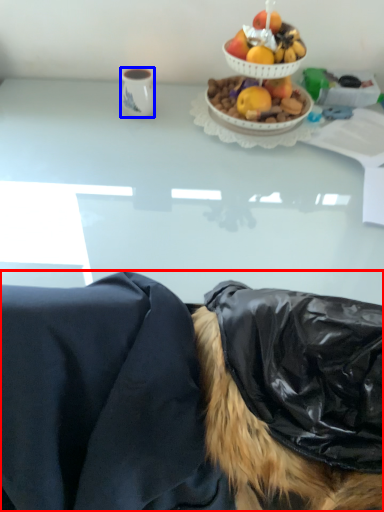
Question: Which of the following is the farthest to the observer, person (highlighted by a red box) or coffee cup (highlighted by a blue box)?

Choices:
 (A) person
 (B) coffee cup

Answer: (B)